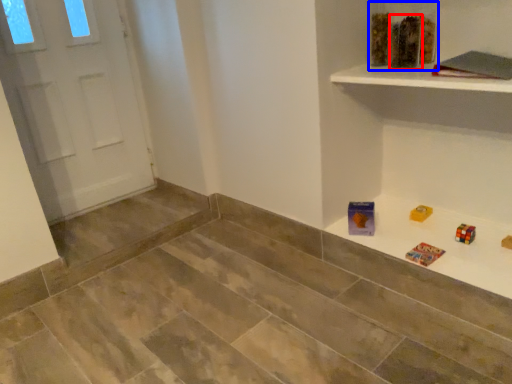
Question: Which of the following is the farthest to the observer, toy (highlighted by a red box) or toy (highlighted by a blue box)?

Choices:
 (A) toy
 (B) toy

Answer: (B)